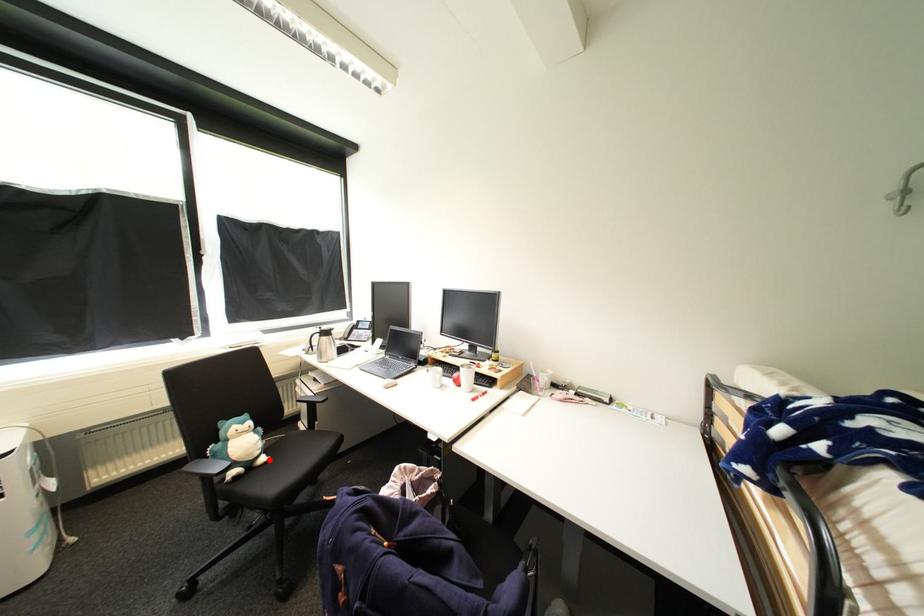
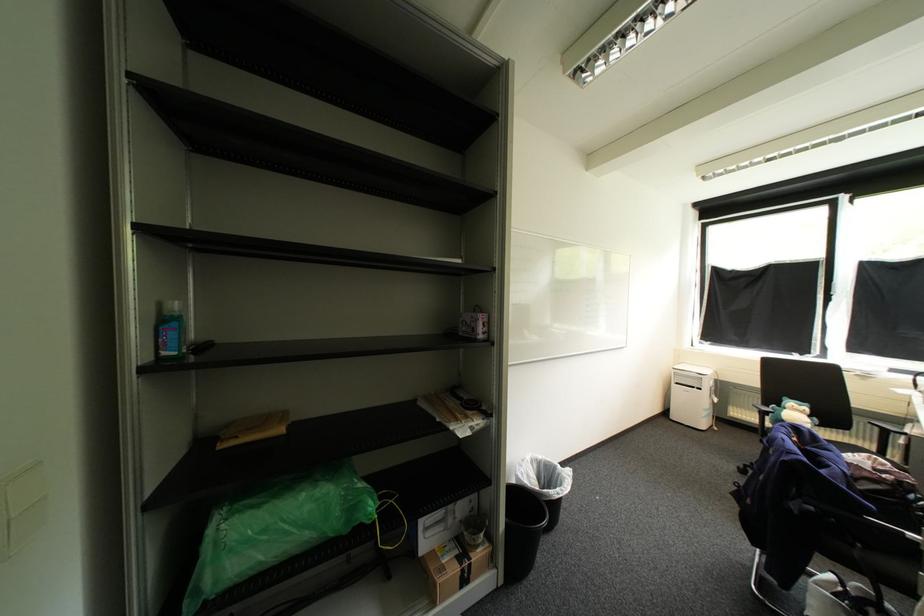
Question: I am providing you with two images of the same scene from different viewpoints. A red point is marked on the first image. Can you still see the location of the red point in image 2?

Choices:
 (A) Yes
 (B) No

Answer: (B)